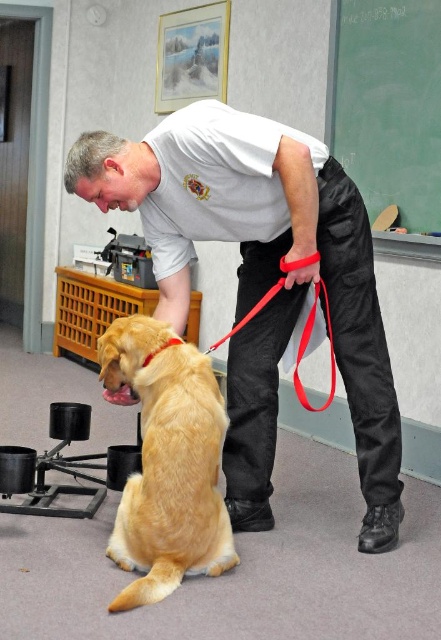
Looking at this image, you are a painter who needs to hang a large canvas that requires a 2.5 meters height clearance. Looking at the image, can you determine if the green chalkboard at upper right and the red nylon leash at lower center will allow you to hang the canvas without obstruction?

The green chalkboard at upper right has a greater height compared to the red nylon leash at lower center. Since the canvas requires 2.5 meters height clearance, the green chalkboard at upper right may pose an obstruction if its height exceeds the required clearance. However, the exact height of the chalkboard isn

Looking at this image, you are a photographer setting up a shoot in this classroom. You need to ensure that the matte white shirt at center and the red nylon leash at lower center are both visible in the frame. Given their sizes, which object will appear larger in the photo?

The matte white shirt at center will appear larger in the photo because it is much taller than the red nylon leash at lower center.